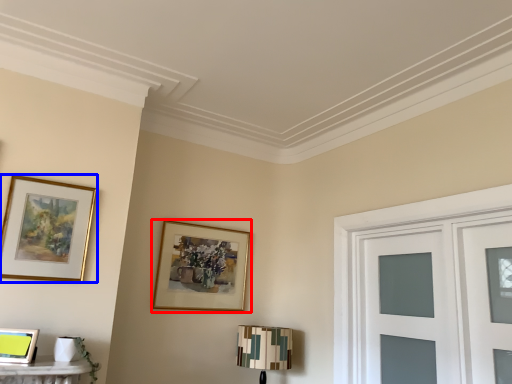
Question: Which of the following is the closest to the observer, picture frame (highlighted by a red box) or picture frame (highlighted by a blue box)?

Choices:
 (A) picture frame
 (B) picture frame

Answer: (B)